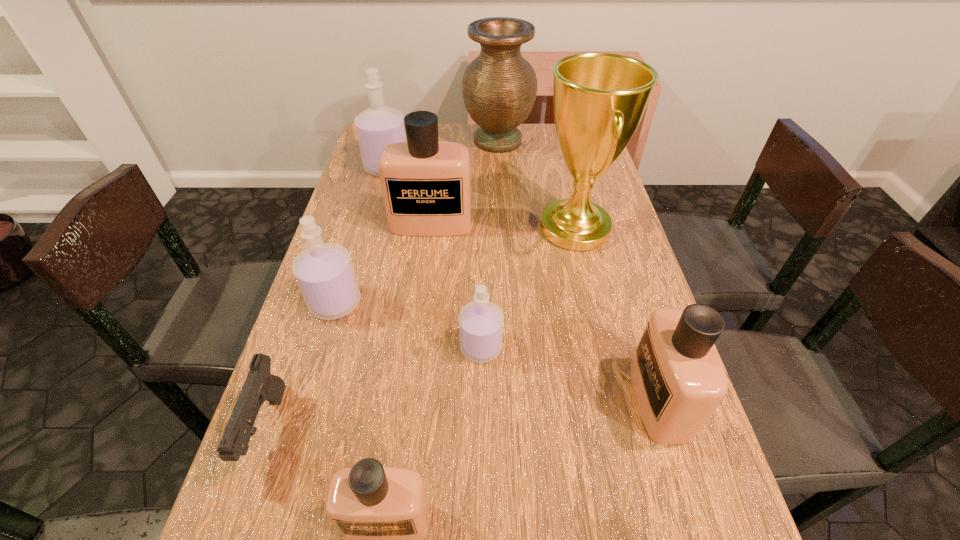
Select which perfume appears as the fourth closest to the fifth nearest object. Please provide its 2D coordinates. Your answer should be formatted as a tuple, i.e. [(x, y)], where the tuple contains the x and y coordinates of a point satisfying the conditions above.

[(379, 125)]

Locate an element on the screen. The width and height of the screenshot is (960, 540). perfume identified as the closest to the green vase is located at coordinates (379, 125).

Find the location of a particular element. the closest beige perfume to the gold award is located at coordinates (426, 184).

The image size is (960, 540). What are the coordinates of `beige perfume that is the nearest to the pistol` in the screenshot? It's located at (383, 512).

Choose which purple perfume is the nearest neighbor to the fifth farthest object. Please provide its 2D coordinates. Your answer should be formatted as a tuple, i.e. [(x, y)], where the tuple contains the x and y coordinates of a point satisfying the conditions above.

[(481, 322)]

At what (x,y) coordinates should I click in order to perform the action: click on purple perfume that is the closest one to the fifth nearest object. Please return your answer as a coordinate pair (x, y). The image size is (960, 540). Looking at the image, I should click on (481, 322).

Locate an element on the screen. The height and width of the screenshot is (540, 960). free space that satisfies the following two spatial constraints: 1. by the handles of the gold award; 2. on the front side of the rightmost purple perfume is located at coordinates (602, 347).